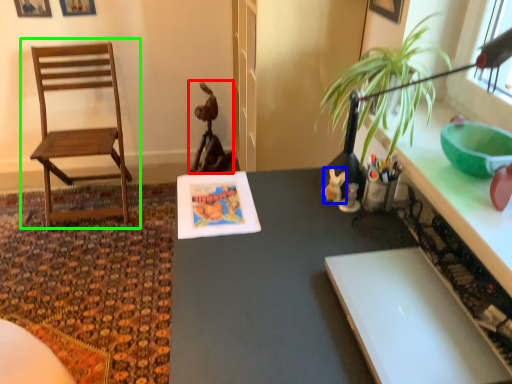
Question: Estimate the real-world distances between objects in this image. Which object is farther from animal (highlighted by a red box), toy (highlighted by a blue box) or chair (highlighted by a green box)?

Choices:
 (A) toy
 (B) chair

Answer: (A)